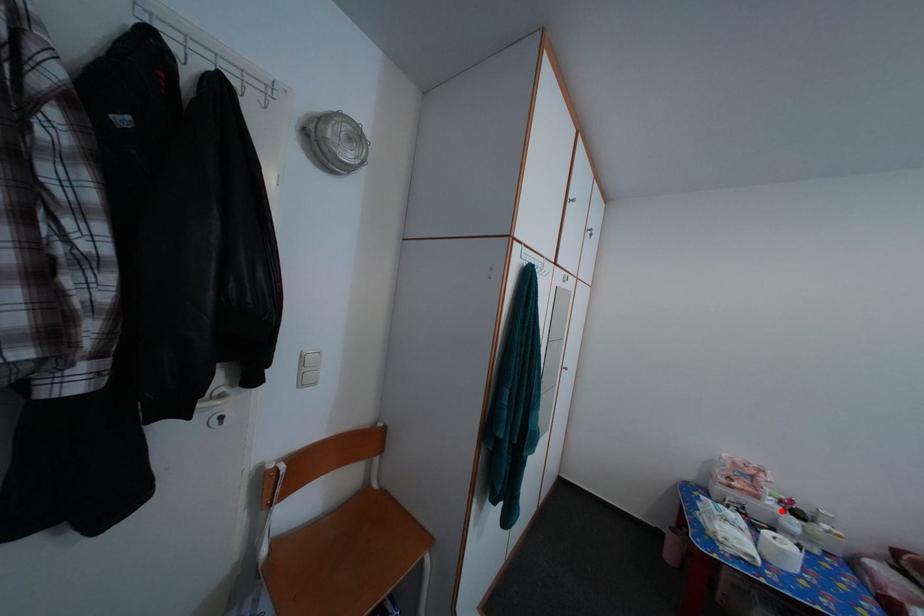
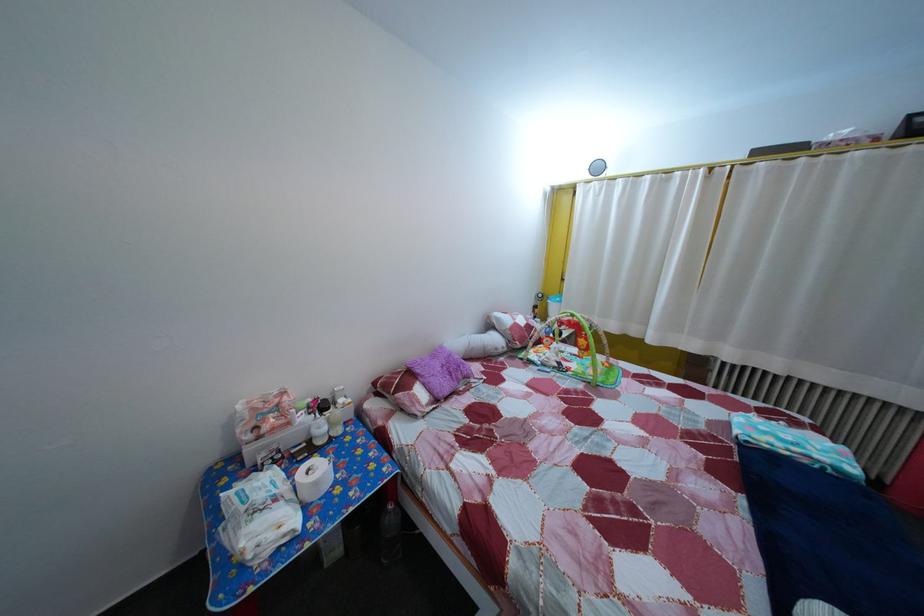
The point at the highlighted location is marked in the first image. Where is the corresponding point in the second image?

(311, 427)